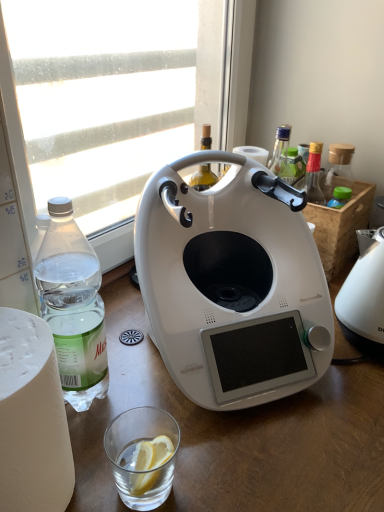
Question: Does clear plastic bottle at left have a greater width compared to white plastic kettle at right, the first kitchen appliance positioned from the right?

Choices:
 (A) yes
 (B) no

Answer: (B)

Question: Is clear plastic bottle at left touching white plastic kettle at right, placed as the 2th kitchen appliance when sorted from left to right?

Choices:
 (A) no
 (B) yes

Answer: (A)

Question: Is there a large distance between clear plastic bottle at left and white plastic kettle at right, placed as the 2th kitchen appliance when sorted from left to right?

Choices:
 (A) no
 (B) yes

Answer: (A)

Question: Can you confirm if clear plastic bottle at left is thinner than white plastic kettle at right, the first kitchen appliance positioned from the right?

Choices:
 (A) no
 (B) yes

Answer: (B)

Question: Is clear plastic bottle at left looking in the opposite direction of white plastic kettle at right, the first kitchen appliance positioned from the right?

Choices:
 (A) no
 (B) yes

Answer: (A)

Question: Does point (364, 273) appear closer or farther from the camera than point (129, 473)?

Choices:
 (A) closer
 (B) farther

Answer: (B)

Question: In terms of size, does white plastic kettle at right, the first kitchen appliance positioned from the right, appear bigger or smaller than clear glass at lower center?

Choices:
 (A) big
 (B) small

Answer: (A)

Question: Considering their positions, is white plastic kettle at right, placed as the 2th kitchen appliance when sorted from left to right, located in front of or behind clear glass at lower center?

Choices:
 (A) behind
 (B) front

Answer: (A)

Question: Would you say white plastic kettle at right, placed as the 2th kitchen appliance when sorted from left to right, is inside or outside clear glass at lower center?

Choices:
 (A) inside
 (B) outside

Answer: (B)

Question: Considering their positions, is clear glass at lower center located in front of or behind transparent glass window at upper left?

Choices:
 (A) behind
 (B) front

Answer: (B)

Question: Is clear glass at lower center wider or thinner than transparent glass window at upper left?

Choices:
 (A) wide
 (B) thin

Answer: (B)

Question: Considering the positions of point (144, 409) and point (104, 39), is point (144, 409) closer or farther from the camera than point (104, 39)?

Choices:
 (A) farther
 (B) closer

Answer: (B)

Question: From a real-world perspective, is clear glass at lower center above or below transparent glass window at upper left?

Choices:
 (A) above
 (B) below

Answer: (B)

Question: Does point (167, 476) appear closer or farther from the camera than point (216, 262)?

Choices:
 (A) farther
 (B) closer

Answer: (B)

Question: Relative to white glossy coffee maker at center, which is counted as the first kitchen appliance, starting from the left, is clear glass at lower center in front or behind?

Choices:
 (A) front
 (B) behind

Answer: (B)